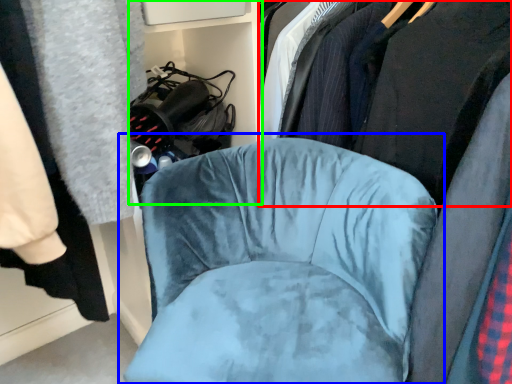
Question: Which object is positioned closest to clothing (highlighted by a red box)? Select from chair (highlighted by a blue box) and bookshelf (highlighted by a green box).

Choices:
 (A) chair
 (B) bookshelf

Answer: (A)